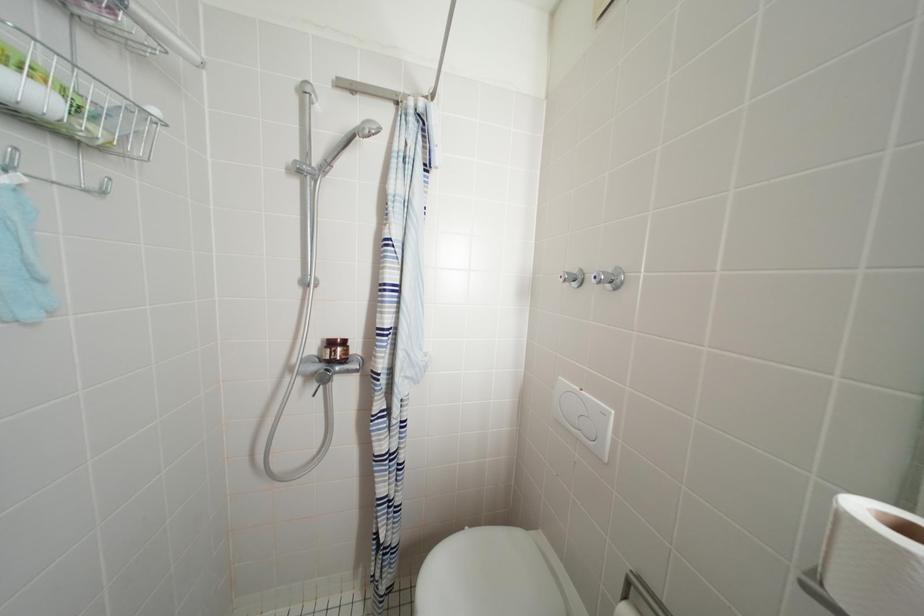
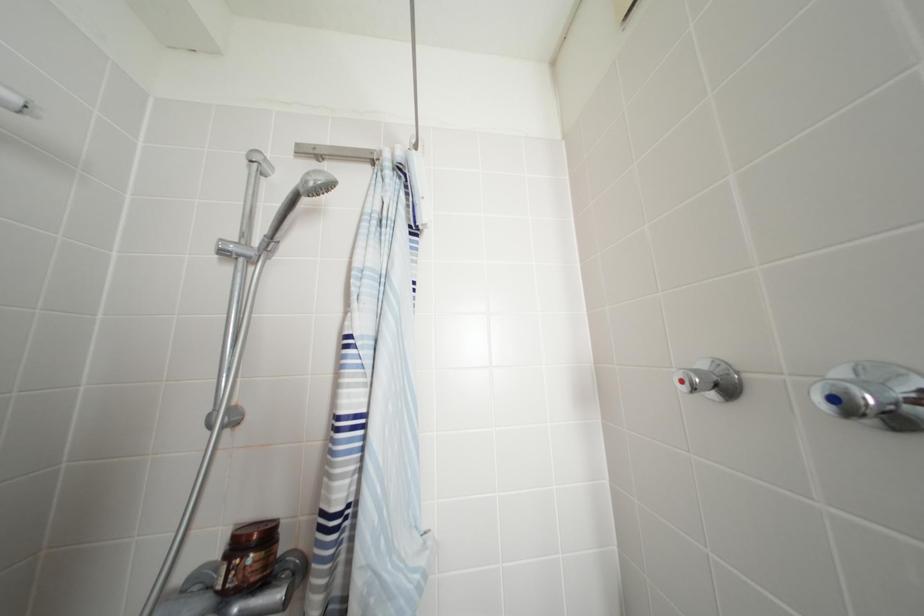
Question: Which direction would the cameraman need to move to produce the second image? Reply with the corresponding letter.

Choices:
 (A) Left
 (B) Right
 (C) Forward
 (D) Backward

Answer: (C)